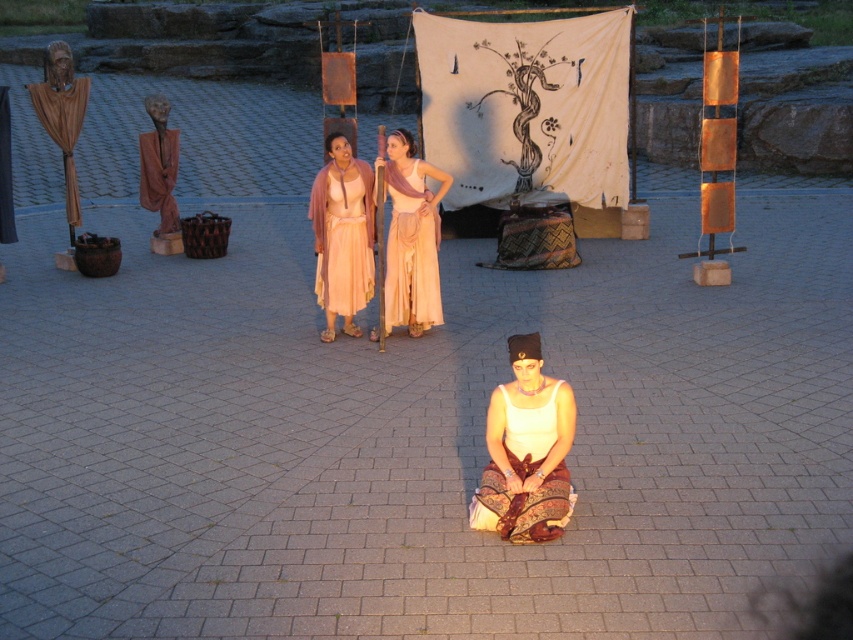
You are an archaeologist examining a historical site. You notice a point marked at coordinates [62,129]. What object is located at this point?

The point at coordinates [62,129] marks the location of the matte brown robe at left.

You are a costume designer observing the scene. You need to determine which costume has a taller silhouette between the matte brown robe at left and the white cotton dress at center. Based on the description, which one is taller?

The matte brown robe at left has a greater height compared to the white cotton dress at center, so the matte brown robe at left is taller.

You are a photographer positioned at the edge of the paved area. You want to take a photo that includes both the matte peach fabric dress at center and the brown matte robe at left. Which object should you focus on first to ensure both are in sharp focus?

The matte peach fabric dress at center is closer to the viewer than the brown matte robe at left. To ensure both are in sharp focus, you should focus on the matte peach fabric dress at center since it is closer, and the brown matte robe at left will naturally fall within the depth of field if focused properly.